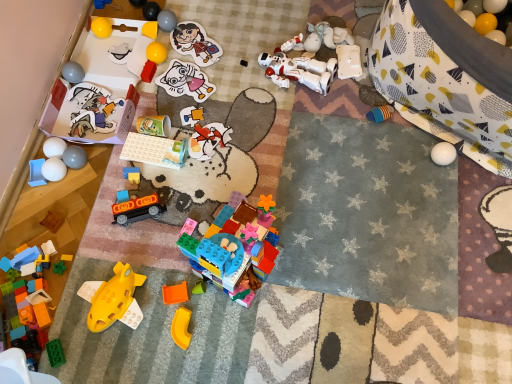
In order to click on free spot in front of matte gray ball at left, the ninth toy when ordered from left to right in this screenshot , I will do `click(68, 211)`.